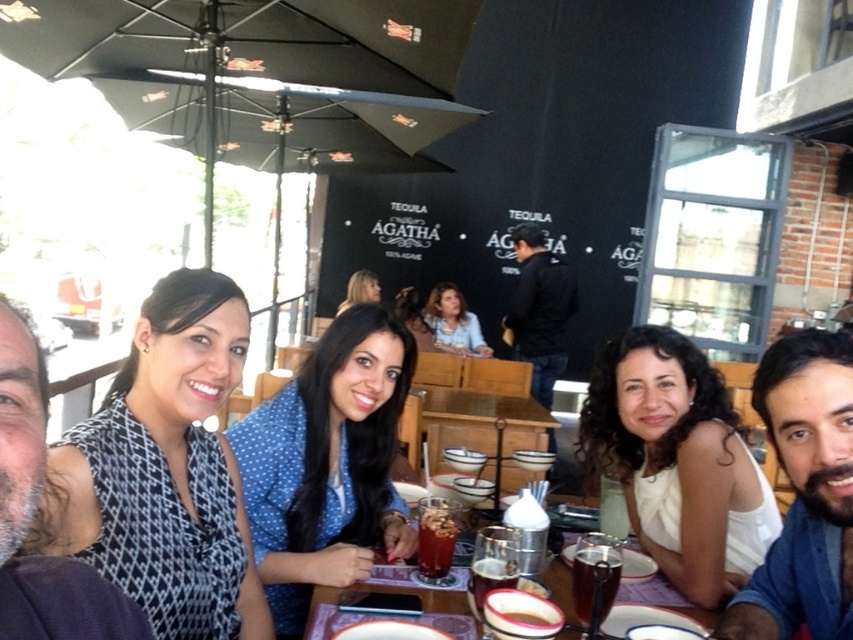
Question: Which point appears farthest from the camera in this image?

Choices:
 (A) click(374, 278)
 (B) click(19, 596)
 (C) click(424, 525)
 (D) click(515, 330)

Answer: (A)

Question: Estimate the real-world distances between objects in this image. Which object is closer to the metallic silver cup at lower center?

Choices:
 (A) blonde hair at center
 (B) brown matte cup at center
 (C) smooth chocolate bar at center

Answer: (B)

Question: Which point is closer to the camera?

Choices:
 (A) (722, 420)
 (B) (598, 580)

Answer: (B)

Question: Is wooden table at center closer to the viewer compared to matte blue shirt at center?

Choices:
 (A) yes
 (B) no

Answer: (A)

Question: Can you confirm if translucent glass cup at table center is bigger than smooth chocolate bar at center?

Choices:
 (A) yes
 (B) no

Answer: (A)

Question: Is blue dotted shirt at center smaller than smooth chocolate bar at center?

Choices:
 (A) no
 (B) yes

Answer: (A)